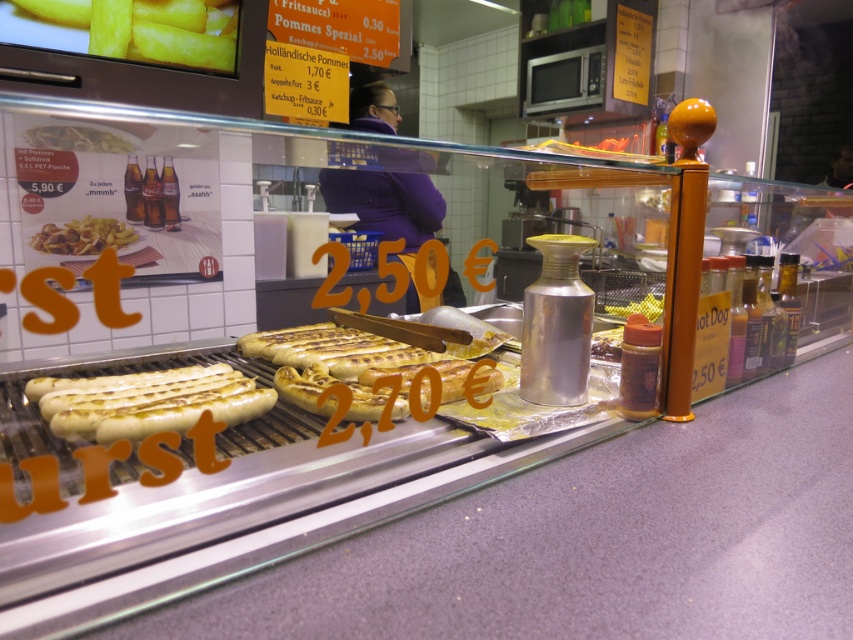
You are a customer at the food stall and want to grab the yellow matte fries at upper left. If your hand is 1.2 meters away from the fries, can you reach them?

The yellow matte fries at upper left and viewer are 1.21 meters apart from each other. Since your hand is 1.2 meters away, you can reach them.

You are a customer at the food stall and want to order the tallest fries available. Which option should you choose between the yellow matte fries at upper left and the matte plastic fries at left?

The matte plastic fries at left are taller than the yellow matte fries at upper left, so you should choose the matte plastic fries at left.

You are standing at the food stall and want to grab a hot dog from the display case. The point you need to reach is marked at point (38, 237). Your arm can extend 5 feet. Can you reach it?

The distance between you and the point (38, 237) is 5.33 feet, which is slightly longer than your arm can reach. You may need to take a step closer.